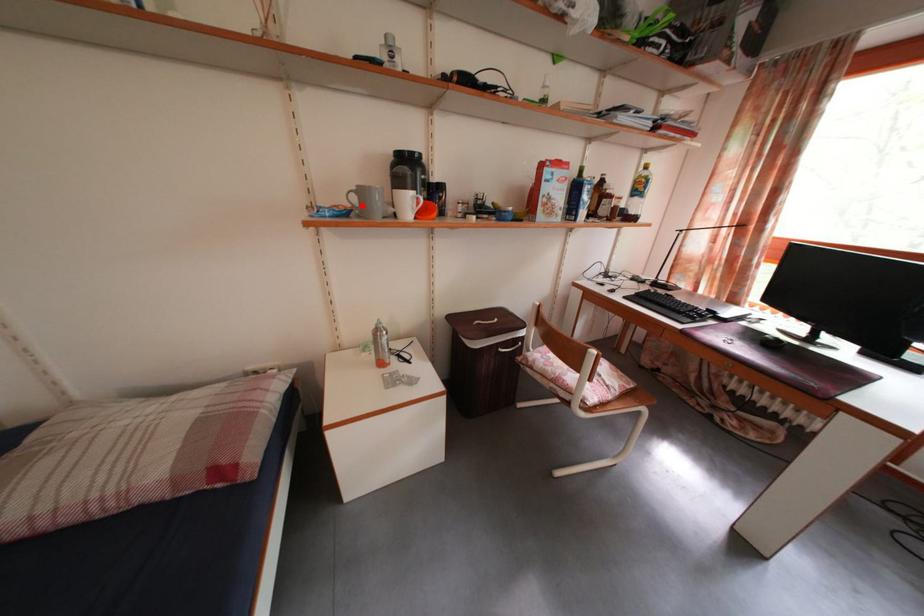
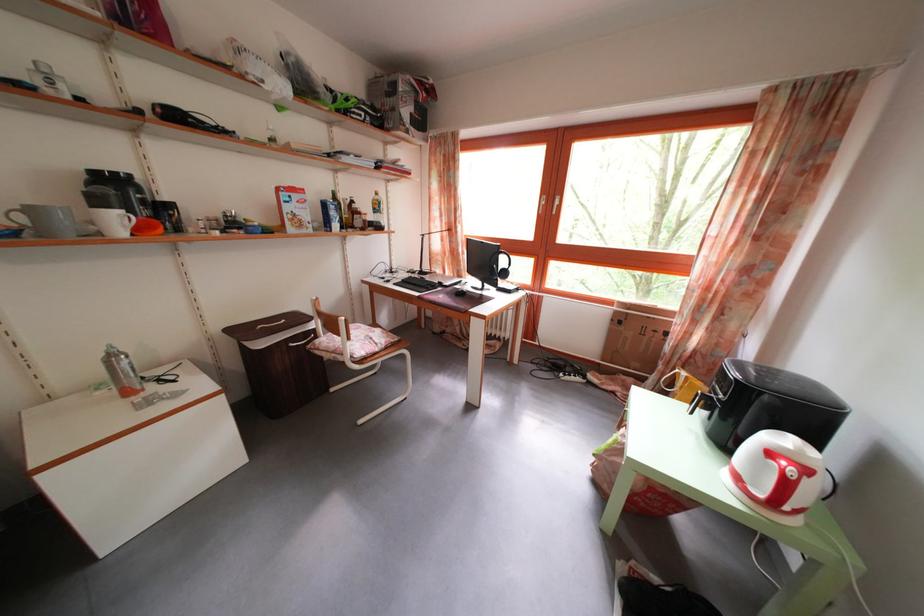
The point at the highlighted location is marked in the first image. Where is the corresponding point in the second image?

(30, 225)